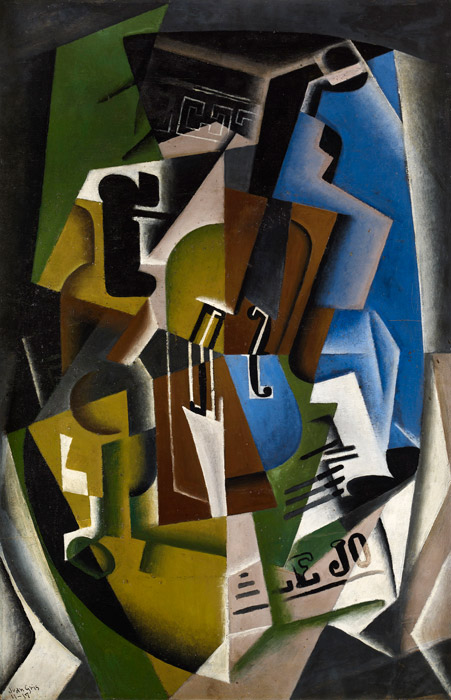
Where is `blue wall`? This screenshot has height=700, width=451. blue wall is located at coordinates (357, 162).